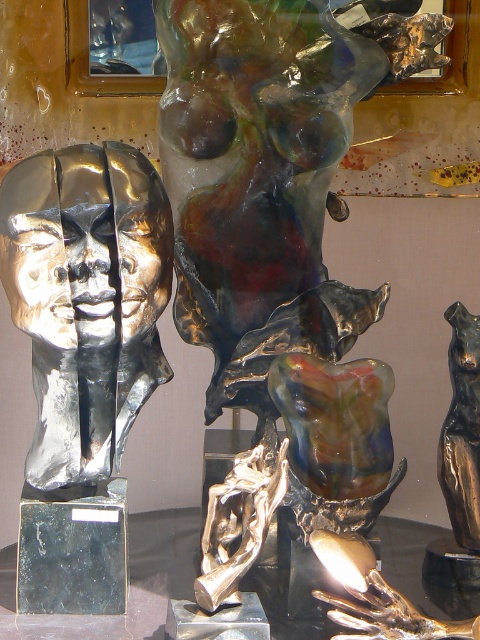
Question: Is shiny bronze sculpture at center thinner than shiny metallic head at left?

Choices:
 (A) no
 (B) yes

Answer: (A)

Question: Which of the following is the farthest from the observer?

Choices:
 (A) (228, 593)
 (B) (49, 150)

Answer: (B)

Question: Does shiny bronze sculpture at center have a smaller size compared to shiny metallic head at left?

Choices:
 (A) yes
 (B) no

Answer: (B)

Question: Does shiny bronze sculpture at center have a lesser width compared to shiny metallic head at left?

Choices:
 (A) no
 (B) yes

Answer: (A)

Question: Which object appears closest to the camera in this image?

Choices:
 (A) shiny bronze sculpture at center
 (B) shiny metallic head at left

Answer: (A)